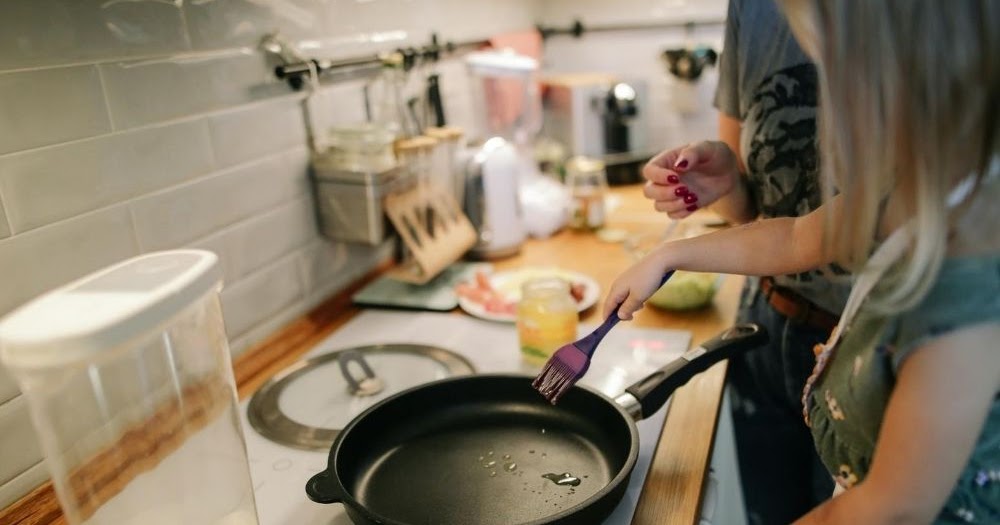
Where is `bar`? bar is located at coordinates (333, 63).